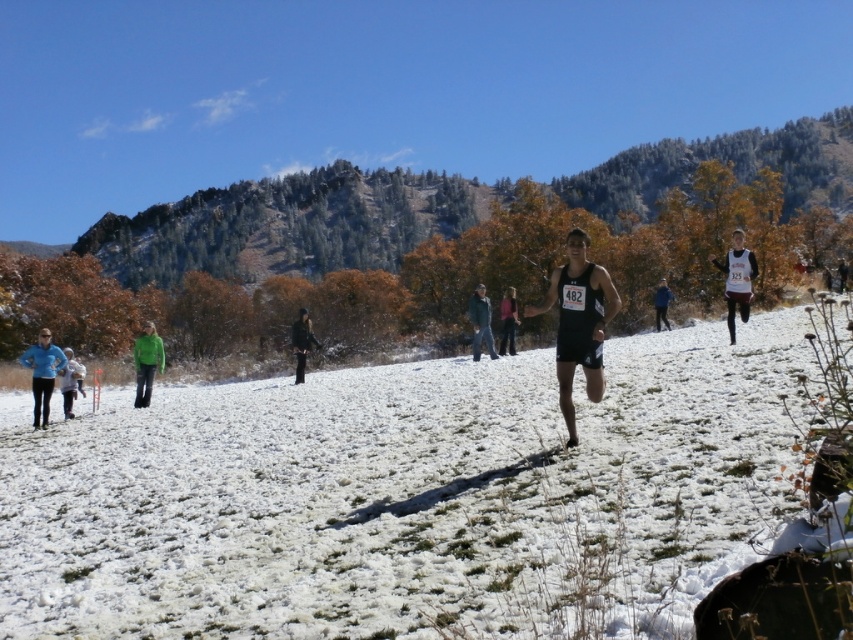
Is white matte running suit at upper right positioned at the back of dark blue running suit at center?

No, white matte running suit at upper right is closer to the viewer.

Is white matte running suit at upper right thinner than dark blue running suit at center?

Incorrect, white matte running suit at upper right's width is not less than dark blue running suit at center's.

Which is behind, point (734, 298) or point (664, 316)?

The point (664, 316) is behind.

This screenshot has width=853, height=640. What are the coordinates of `white matte running suit at upper right` in the screenshot? It's located at (737, 280).

Who is shorter, dark brown leather jacket at center or dark blue running suit at center?

dark brown leather jacket at center is shorter.

Image resolution: width=853 pixels, height=640 pixels. What do you see at coordinates (302, 342) in the screenshot?
I see `dark brown leather jacket at center` at bounding box center [302, 342].

Locate an element on the screen. This screenshot has width=853, height=640. dark brown leather jacket at center is located at coordinates (302, 342).

Is black matte running suit at center below green wool jacket at center?

Yes.

What do you see at coordinates (578, 323) in the screenshot? I see `black matte running suit at center` at bounding box center [578, 323].

Locate an element on the screen. black matte running suit at center is located at coordinates (578, 323).